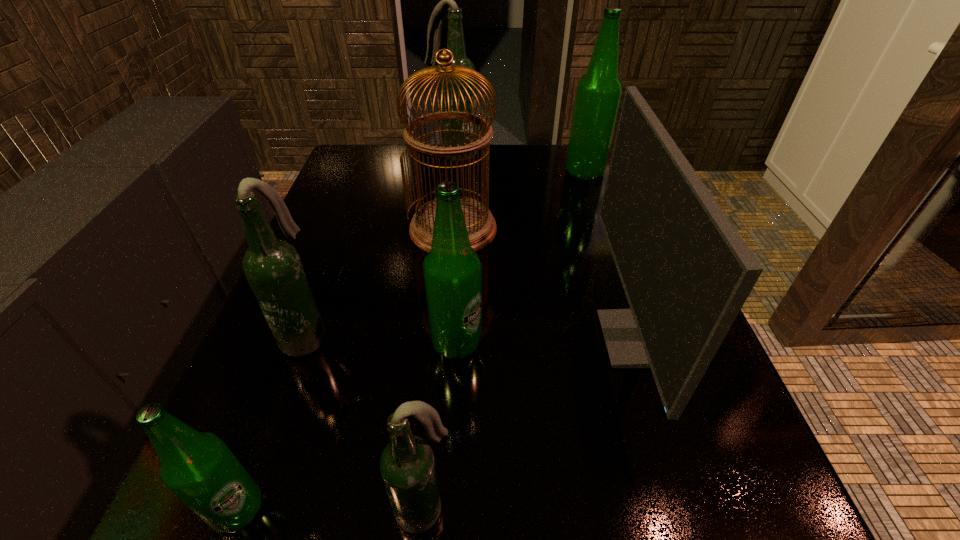
Identify the location of vacant space that satisfies the following two spatial constraints: 1. on the front side of the farthest dark beer bottle; 2. on the left side of the smallest dark beer bottle. This screenshot has height=540, width=960. (421, 509).